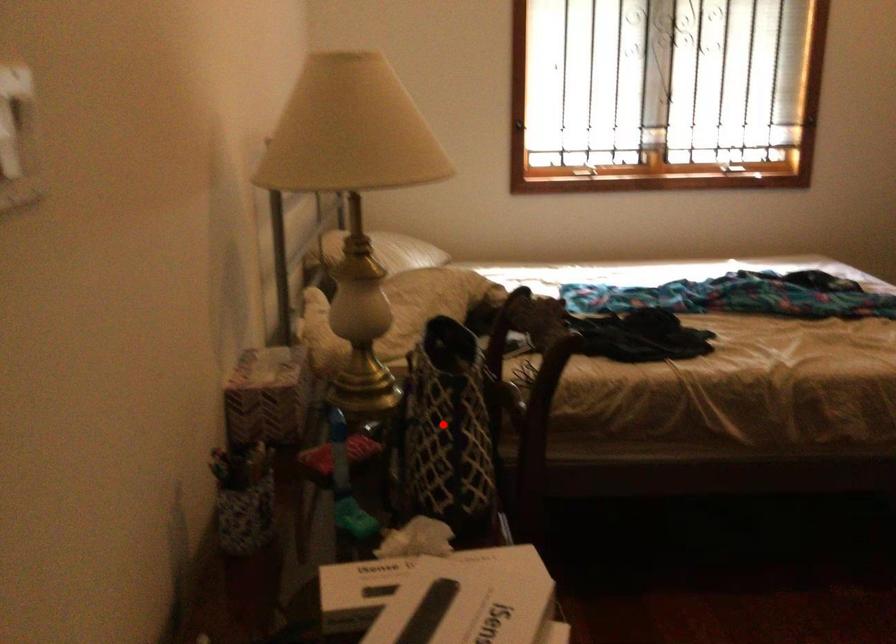
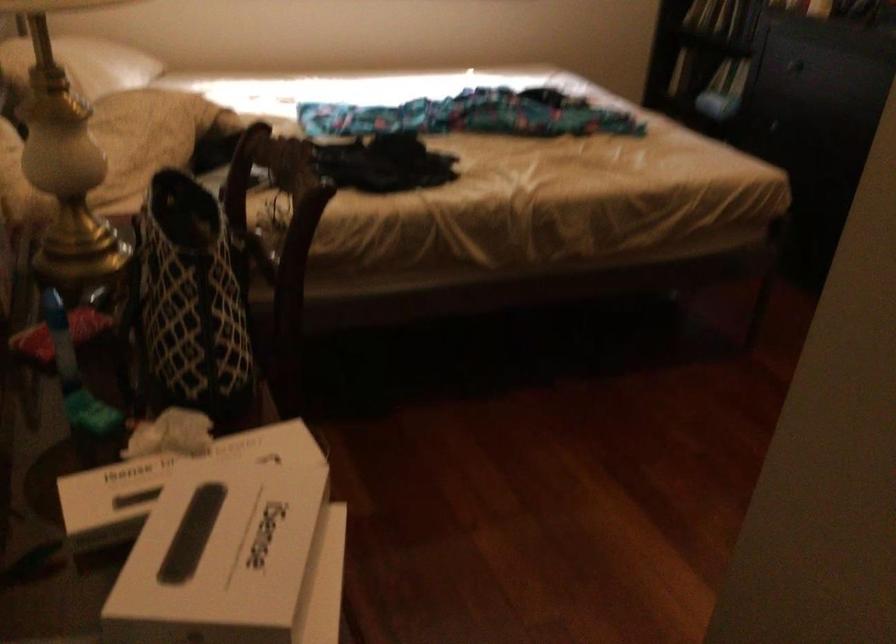
The point at the highlighted location is marked in the first image. Where is the corresponding point in the second image?

(188, 301)